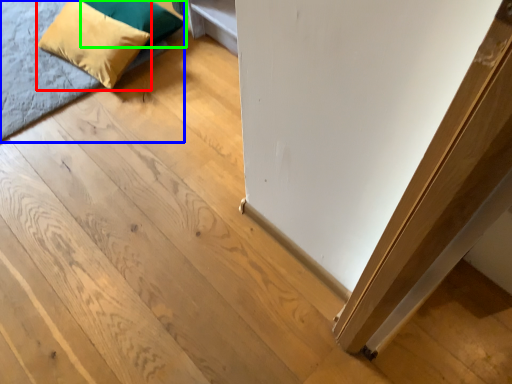
Question: Estimate the real-world distances between objects in this image. Which object is closer to pillow (highlighted by a red box), bed (highlighted by a blue box) or pillow (highlighted by a green box)?

Choices:
 (A) bed
 (B) pillow

Answer: (B)